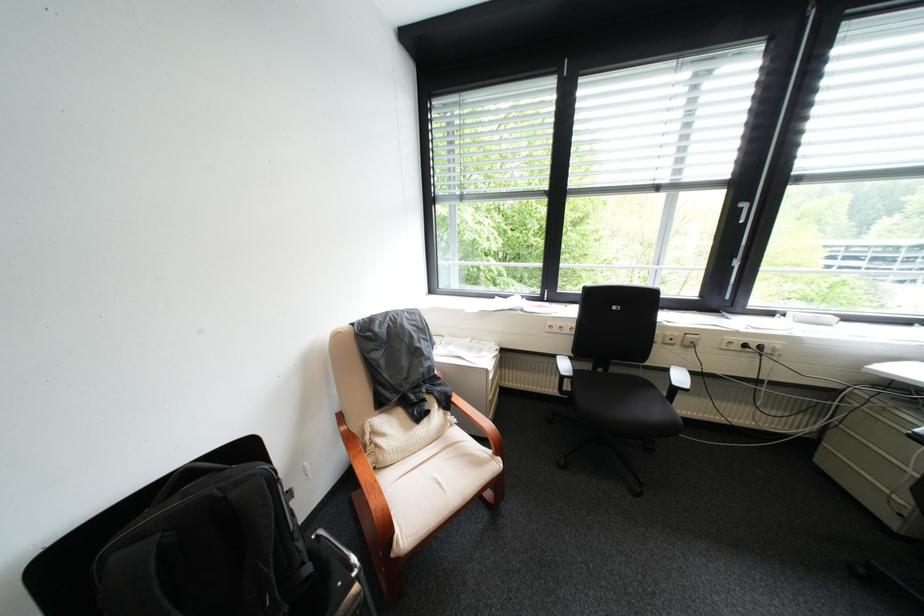
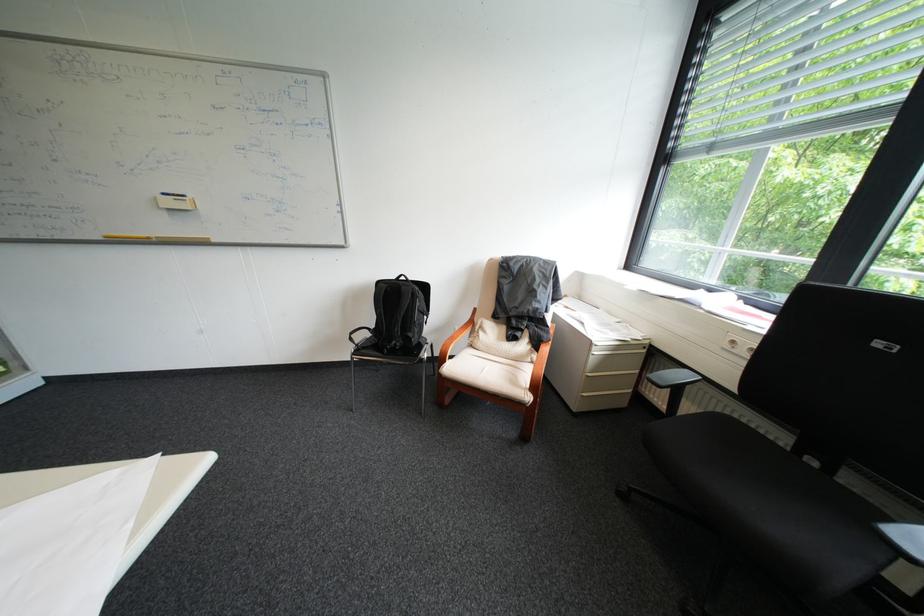
Locate, in the second image, the point that corresponds to [563,326] in the first image.

(746, 342)